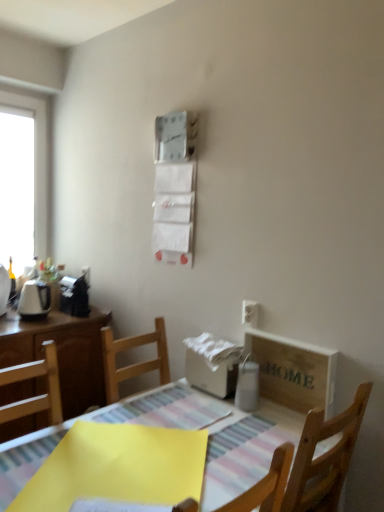
This screenshot has height=512, width=384. Identify the location of free space to the back side of yellow paper at lower left. (163, 409).